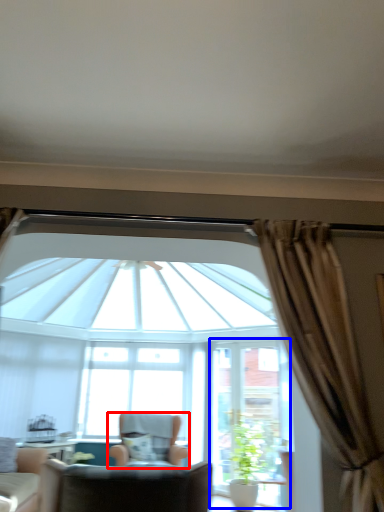
Question: Among these objects, which one is farthest to the camera, chair (highlighted by a red box) or screen door (highlighted by a blue box)?

Choices:
 (A) chair
 (B) screen door

Answer: (B)